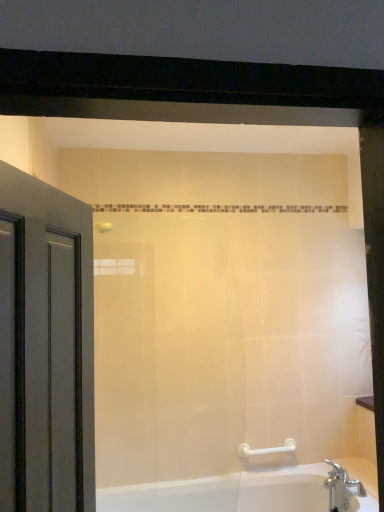
Question: Is white plastic grab bar at lower right wider than chrome metallic faucet at lower right?

Choices:
 (A) no
 (B) yes

Answer: (A)

Question: Is white plastic grab bar at lower right surrounding chrome metallic faucet at lower right?

Choices:
 (A) yes
 (B) no

Answer: (B)

Question: Considering the relative sizes of white plastic grab bar at lower right and chrome metallic faucet at lower right in the image provided, is white plastic grab bar at lower right taller than chrome metallic faucet at lower right?

Choices:
 (A) no
 (B) yes

Answer: (A)

Question: From the image's perspective, is white plastic grab bar at lower right beneath chrome metallic faucet at lower right?

Choices:
 (A) no
 (B) yes

Answer: (A)

Question: Is white plastic grab bar at lower right at the right side of chrome metallic faucet at lower right?

Choices:
 (A) yes
 (B) no

Answer: (B)

Question: Does white plastic grab bar at lower right come in front of chrome metallic faucet at lower right?

Choices:
 (A) yes
 (B) no

Answer: (B)

Question: Is chrome metallic faucet at lower right oriented towards white plastic grab bar at lower right?

Choices:
 (A) no
 (B) yes

Answer: (A)

Question: Is chrome metallic faucet at lower right facing away from white plastic grab bar at lower right?

Choices:
 (A) no
 (B) yes

Answer: (A)

Question: Are chrome metallic faucet at lower right and white plastic grab bar at lower right located far from each other?

Choices:
 (A) no
 (B) yes

Answer: (A)

Question: Considering the relative sizes of chrome metallic faucet at lower right and white plastic grab bar at lower right in the image provided, is chrome metallic faucet at lower right shorter than white plastic grab bar at lower right?

Choices:
 (A) no
 (B) yes

Answer: (A)

Question: Are chrome metallic faucet at lower right and white plastic grab bar at lower right making contact?

Choices:
 (A) yes
 (B) no

Answer: (B)

Question: From the image's perspective, is chrome metallic faucet at lower right beneath white plastic grab bar at lower right?

Choices:
 (A) yes
 (B) no

Answer: (A)

Question: From a real-world perspective, is white glossy bathtub at lower right located higher than chrome metallic faucet at lower right?

Choices:
 (A) no
 (B) yes

Answer: (A)